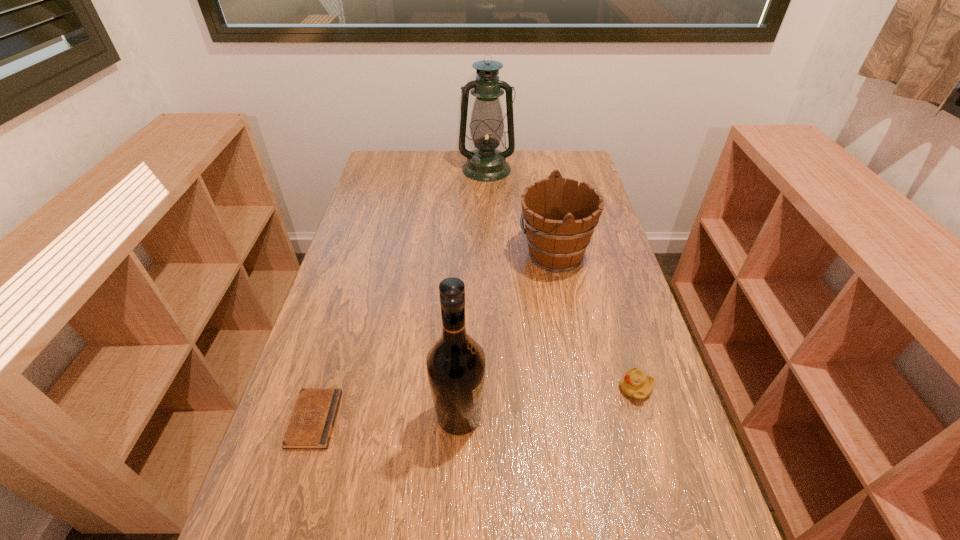
Identify the location of unoccupied position between the duckling and the third tallest object. (595, 321).

This screenshot has width=960, height=540. I want to click on free space between the farthest object and the diary, so click(x=400, y=294).

Where is `object that is the third closest to the second shortest object`? object that is the third closest to the second shortest object is located at coordinates (311, 424).

Locate an element on the screen. This screenshot has height=540, width=960. the fourth closest object to the second farthest object is located at coordinates (311, 424).